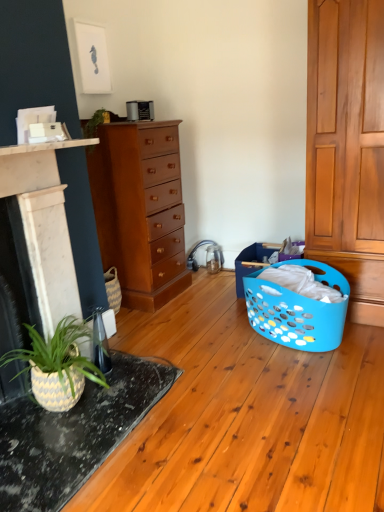
What do you see at coordinates (34, 243) in the screenshot?
I see `white marble fireplace at left` at bounding box center [34, 243].

This screenshot has height=512, width=384. Find the location of `mahogany wood chest of drawers at center`. mahogany wood chest of drawers at center is located at coordinates (140, 210).

This screenshot has height=512, width=384. I want to click on fireplace lying above the speckled ceramic table at lower left (from the image's perspective), so click(x=34, y=243).

Would you say speckled ceramic table at lower left is to the left or to the right of white marble fireplace at left in the picture?

From the image, it's evident that speckled ceramic table at lower left is to the right of white marble fireplace at left.

From a real-world perspective, which is physically below, speckled ceramic table at lower left or white marble fireplace at left?

From a 3D spatial view, speckled ceramic table at lower left is below.

Which is in front, point (43, 420) or point (26, 378)?

Positioned in front is point (43, 420).

From the image's perspective, between blue plastic laundry basket at lower right and speckled ceramic table at lower left, who is located below?

speckled ceramic table at lower left.

From a real-world perspective, between blue plastic laundry basket at lower right and speckled ceramic table at lower left, who is vertically higher?

In real-world perspective, blue plastic laundry basket at lower right is above.

Which of these two, blue plastic laundry basket at lower right or speckled ceramic table at lower left, is smaller?

Smaller between the two is speckled ceramic table at lower left.

Does point (336, 292) appear closer or farther from the camera than point (8, 426)?

Point (336, 292) is positioned farther from the camera compared to point (8, 426).

From the image's perspective, between white marble fireplace at left and mahogany wood chest of drawers at center, which one is located above?

mahogany wood chest of drawers at center is shown above in the image.

Locate an element on the screen. This screenshot has height=512, width=384. the chest of drawers above the white marble fireplace at left (from the image's perspective) is located at coordinates (140, 210).

Is white marble fireplace at left outside of mahogany wood chest of drawers at center?

Yes, white marble fireplace at left is not within mahogany wood chest of drawers at center.

Does white marble fireplace at left appear on the right side of mahogany wood chest of drawers at center?

Incorrect, white marble fireplace at left is not on the right side of mahogany wood chest of drawers at center.

Is blue plastic laundry basket at lower right oriented away from mahogany wood chest of drawers at center?

No.

From a real-world perspective, between blue plastic laundry basket at lower right and mahogany wood chest of drawers at center, who is vertically lower?

blue plastic laundry basket at lower right is physically lower.

From the picture: Does blue plastic laundry basket at lower right come behind mahogany wood chest of drawers at center?

No, blue plastic laundry basket at lower right is in front of mahogany wood chest of drawers at center.

From a real-world perspective, is white marble fireplace at left physically below blue plastic laundry basket at lower right?

No, from a real-world perspective, white marble fireplace at left is not under blue plastic laundry basket at lower right.

Between white marble fireplace at left and blue plastic laundry basket at lower right, which one has less height?

blue plastic laundry basket at lower right.

Can we say white marble fireplace at left lies outside blue plastic laundry basket at lower right?

Yes, white marble fireplace at left is located beyond the bounds of blue plastic laundry basket at lower right.

Considering the sizes of objects white marble fireplace at left and blue plastic laundry basket at lower right in the image provided, who is wider, white marble fireplace at left or blue plastic laundry basket at lower right?

blue plastic laundry basket at lower right is wider.

Measure the distance from speckled ceramic table at lower left to mahogany wood chest of drawers at center.

The distance of speckled ceramic table at lower left from mahogany wood chest of drawers at center is 1.09 meters.

Choose the correct answer: Is speckled ceramic table at lower left inside mahogany wood chest of drawers at center or outside it?

speckled ceramic table at lower left cannot be found inside mahogany wood chest of drawers at center.

Are speckled ceramic table at lower left and mahogany wood chest of drawers at center located far from each other?

Yes, speckled ceramic table at lower left and mahogany wood chest of drawers at center are quite far apart.

From a real-world perspective, does speckled ceramic table at lower left sit lower than mahogany wood chest of drawers at center?

Yes, from a real-world perspective, speckled ceramic table at lower left is beneath mahogany wood chest of drawers at center.

Which of these two, mahogany wood chest of drawers at center or speckled ceramic table at lower left, is thinner?

mahogany wood chest of drawers at center.

Between mahogany wood chest of drawers at center and speckled ceramic table at lower left, which one appears on the right side from the viewer's perspective?

mahogany wood chest of drawers at center.

Considering the relative positions of mahogany wood chest of drawers at center and speckled ceramic table at lower left in the image provided, is mahogany wood chest of drawers at center behind speckled ceramic table at lower left?

Yes, mahogany wood chest of drawers at center is behind speckled ceramic table at lower left.

Is speckled ceramic table at lower left located within mahogany wood chest of drawers at center?

No, speckled ceramic table at lower left is located outside of mahogany wood chest of drawers at center.

In order to click on table below the white marble fireplace at left (from a real-world perspective) in this screenshot , I will do `click(74, 434)`.

Locate an element on the screen. basket located above the speckled ceramic table at lower left (from a real-world perspective) is located at coordinates (298, 304).

From the image, which object appears to be farther from speckled ceramic table at lower left, mahogany wood chest of drawers at center or blue plastic laundry basket at lower right?

mahogany wood chest of drawers at center.

From the image, which object appears to be farther from speckled ceramic table at lower left, blue plastic laundry basket at lower right or mahogany wood chest of drawers at center?

mahogany wood chest of drawers at center is further to speckled ceramic table at lower left.

Estimate the real-world distances between objects in this image. Which object is further from white marble fireplace at left, blue plastic laundry basket at lower right or speckled ceramic table at lower left?

Among the two, blue plastic laundry basket at lower right is located further to white marble fireplace at left.

Estimate the real-world distances between objects in this image. Which object is closer to mahogany wood chest of drawers at center, speckled ceramic table at lower left or white marble fireplace at left?

white marble fireplace at left is closer to mahogany wood chest of drawers at center.

From the picture: From the image, which object appears to be farther from blue plastic laundry basket at lower right, white marble fireplace at left or mahogany wood chest of drawers at center?

white marble fireplace at left is positioned further to the anchor blue plastic laundry basket at lower right.

Which object lies nearer to the anchor point speckled ceramic table at lower left, blue plastic laundry basket at lower right or white marble fireplace at left?

Among the two, white marble fireplace at left is located nearer to speckled ceramic table at lower left.

Which object lies further to the anchor point mahogany wood chest of drawers at center, white marble fireplace at left or blue plastic laundry basket at lower right?

blue plastic laundry basket at lower right lies further to mahogany wood chest of drawers at center than the other object.

When comparing their distances from blue plastic laundry basket at lower right, does white marble fireplace at left or speckled ceramic table at lower left seem closer?

speckled ceramic table at lower left.

Find the location of `chest of drawers between speckled ceramic table at lower left and blue plastic laundry basket at lower right from left to right`. chest of drawers between speckled ceramic table at lower left and blue plastic laundry basket at lower right from left to right is located at coordinates point(140,210).

Where is `table situated between white marble fireplace at left and blue plastic laundry basket at lower right from left to right`? The image size is (384, 512). table situated between white marble fireplace at left and blue plastic laundry basket at lower right from left to right is located at coordinates (74, 434).

Image resolution: width=384 pixels, height=512 pixels. I want to click on chest of drawers between white marble fireplace at left and blue plastic laundry basket at lower right in the horizontal direction, so click(140, 210).

In order to click on fireplace between speckled ceramic table at lower left and mahogany wood chest of drawers at center in the front-back direction in this screenshot , I will do `click(34, 243)`.